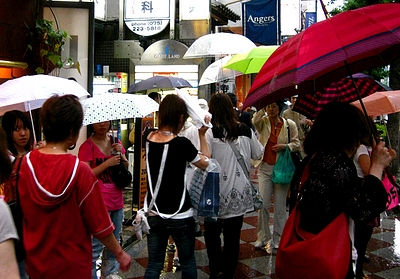
Find the location of a particular element. This screenshot has width=400, height=279. plant is located at coordinates (48, 42).